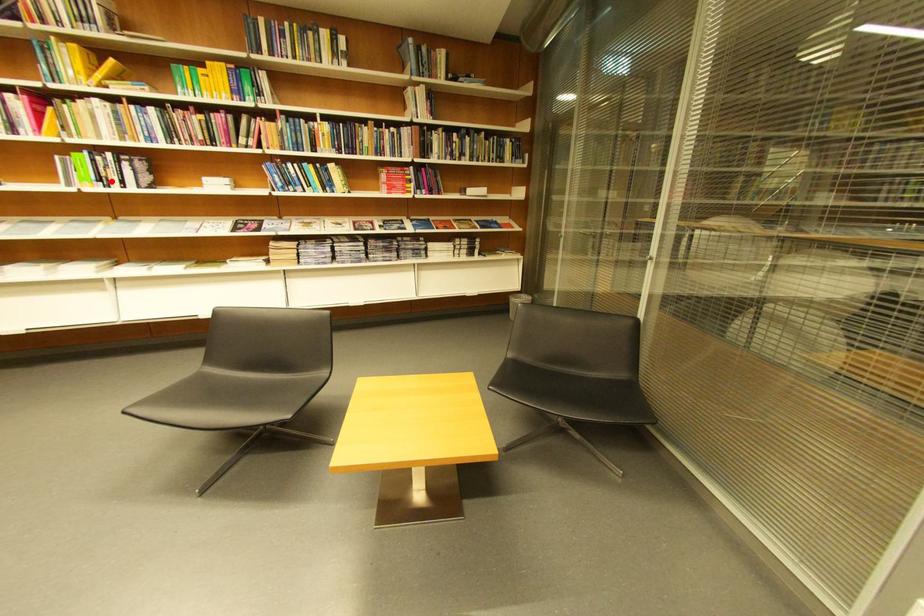
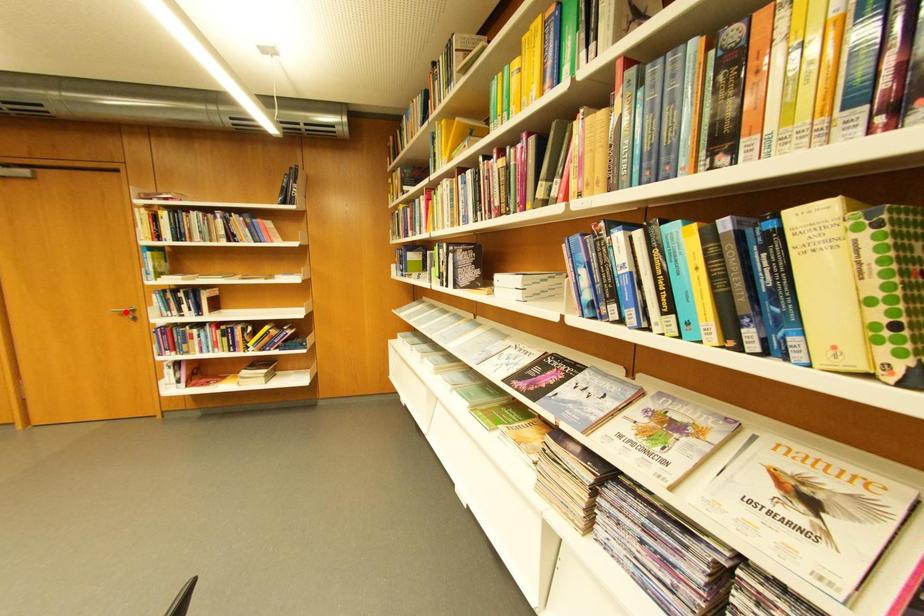
I am providing you with two images of the same scene from different viewpoints. A red point is marked on the first image and another point is marked on the second image. Is the red point in image1 aligned with the point shown in image2?

No